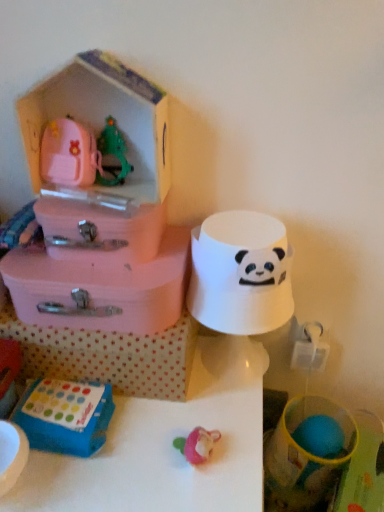
I want to click on free point above pink plastic suitcase at upper left, the 3th storage box in the bottom-to-top sequence (from a real-world perspective), so click(x=107, y=193).